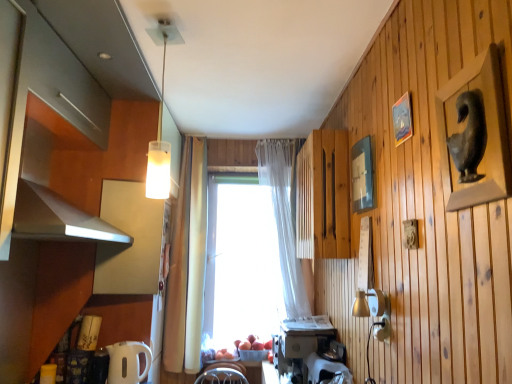
Question: Based on their positions, is matte wood cabinet at upper left, the first cabinetry when ordered from left to right, located to the left or right of wooden picture frame at upper right, which is the second picture frame from back to front?

Choices:
 (A) right
 (B) left

Answer: (B)

Question: From a real-world perspective, is matte wood cabinet at upper left, the first cabinetry when ordered from left to right, physically located above or below wooden picture frame at upper right, the 2th picture frame when ordered from front to back?

Choices:
 (A) above
 (B) below

Answer: (A)

Question: Which object is positioned farthest from the wooden picture frame at upper right, which is the second picture frame from back to front?

Choices:
 (A) translucent glass pendant light at upper center
 (B) wooden slats at center, acting as the 1th cabinetry starting from the right
 (C) matte wood cabinet at upper left, which is the third cabinetry in right-to-left order
 (D) transparent glass window at center
 (E) white glossy electric kettle at lower left, which appears as the first appliance when viewed from the left

Answer: (D)

Question: Which is farther from the white plastic coffee maker at lower center, acting as the 2th appliance starting from the right?

Choices:
 (A) matte wood cabinet at upper left, the first cabinetry when ordered from left to right
 (B) translucent fabric curtain at center
 (C) wooden picture frame at upper right, which is the second picture frame from back to front
 (D) white plastic toaster at lower center, which appears as the 3th appliance when viewed from the left
 (E) matte gray statue at upper right, the first picture frame when ordered from front to back

Answer: (A)